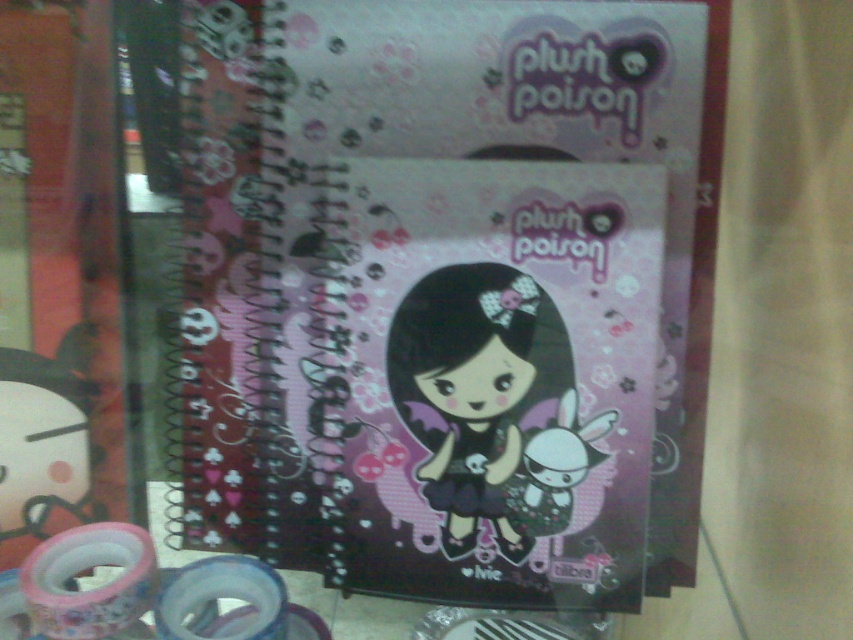
Is point (677, 560) positioned in front of point (492, 394)?

No, it is not.

Between point (480, 177) and point (451, 374), which one is positioned behind?

Positioned behind is point (451, 374).

Identify the location of matte pink notebook at center. This screenshot has height=640, width=853. (450, 291).